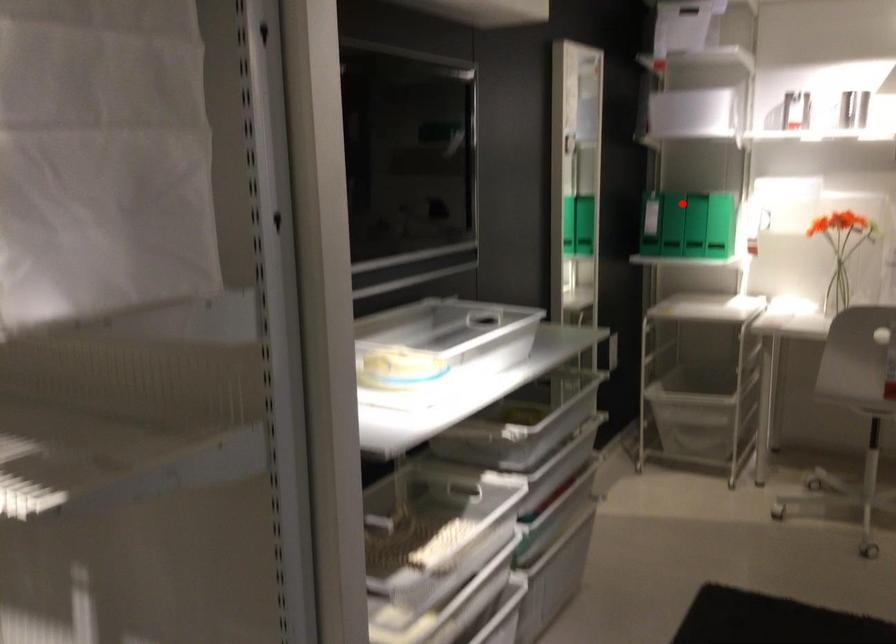
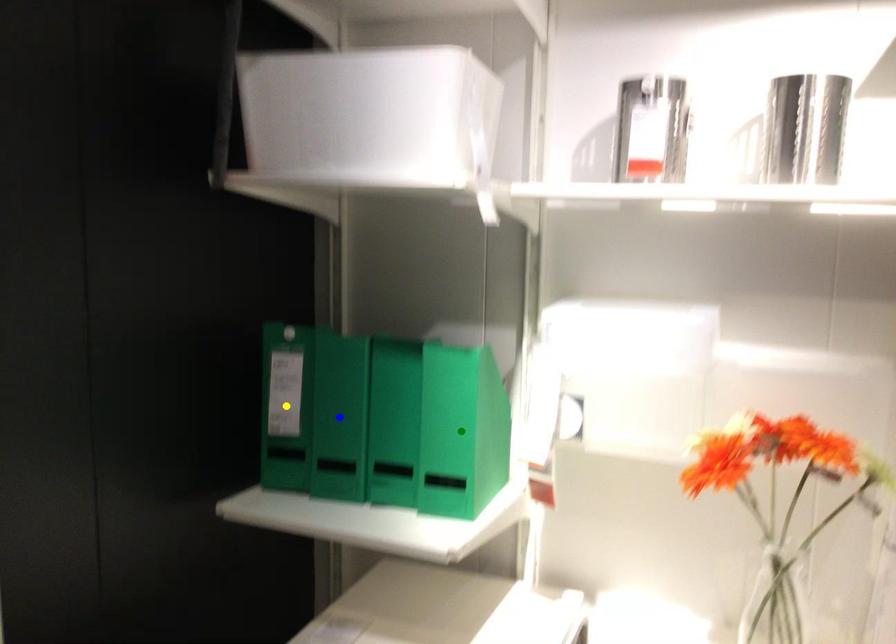
Question: I am providing you with two images of the same scene from different viewpoints. A red point is marked on the first image. You are given multiple points on the second image. Which point in image 2 is actually the same real-world point as the red point in image 1?

Choices:
 (A) yellow point
 (B) green point
 (C) blue point

Answer: (A)